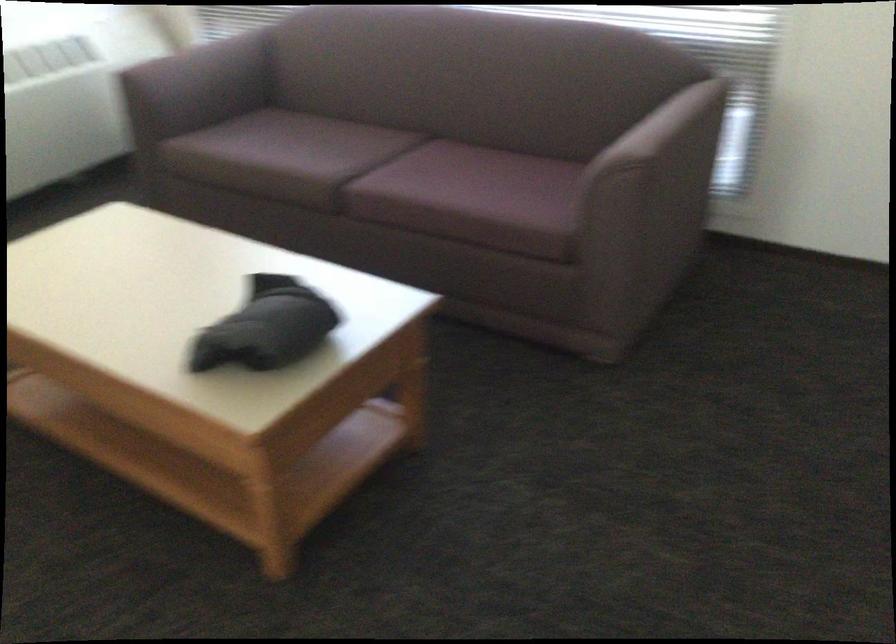
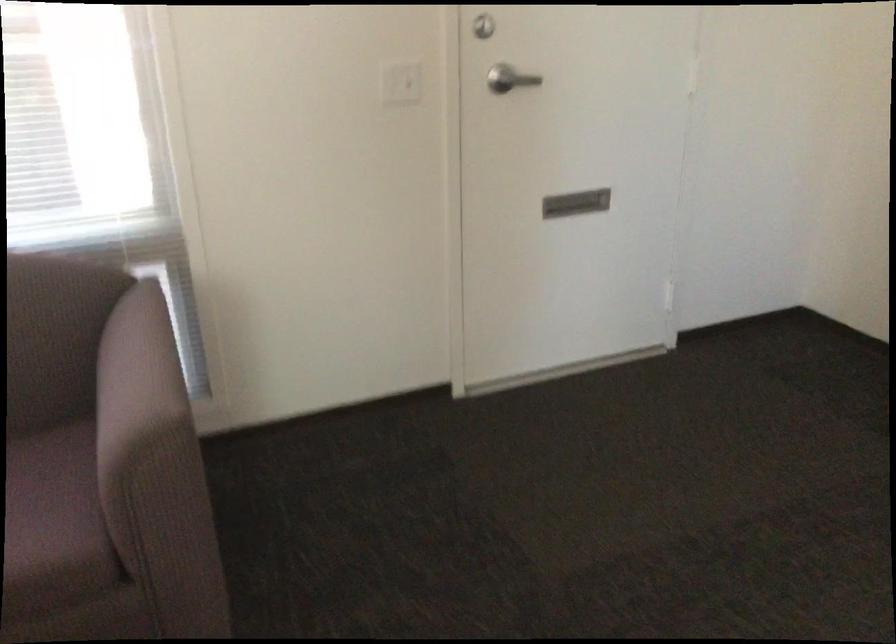
Question: The camera is either moving clockwise (left) or counter-clockwise (right) around the object. The first image is from the beginning of the video and the second image is from the end. Is the camera moving left or right when shooting the video?

Choices:
 (A) Left
 (B) Right

Answer: (A)